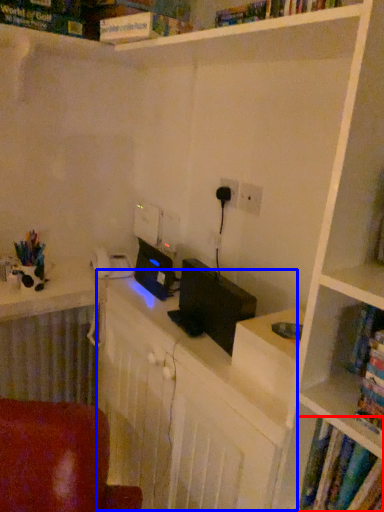
Question: Which point is further to the camera, book (highlighted by a red box) or computer desk (highlighted by a blue box)?

Choices:
 (A) book
 (B) computer desk

Answer: (B)